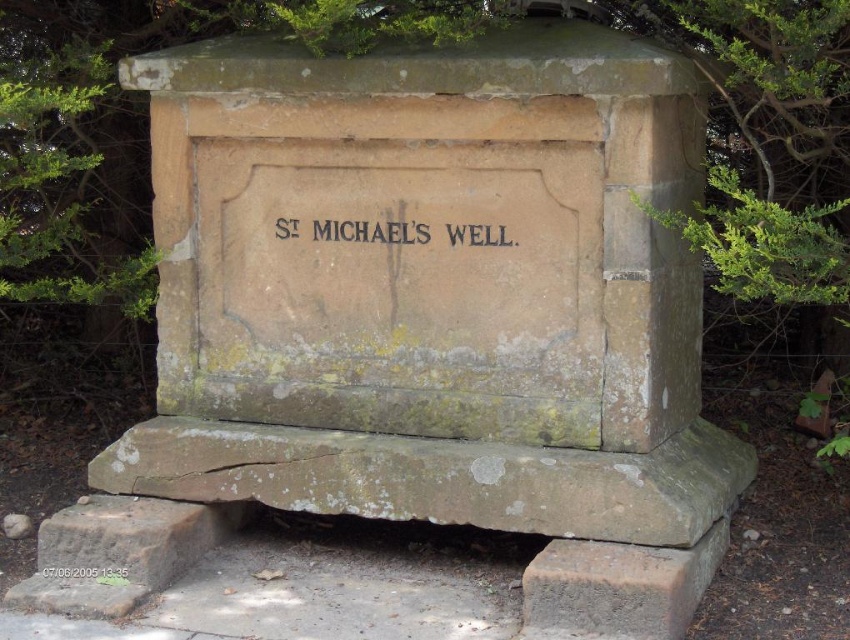
You are a hiker who has reached the brown stone monument at center and the black stone engraving at center. Which object is closer to you as you stand in front of them?

The brown stone monument at center is closer to you since it is in front of the black stone engraving at center.

You are a historian examining the brown stone monument at center and the black stone engraving at center. Which object is taller?

The brown stone monument at center is taller than the black stone engraving at center.

You are a historian examining the St. Michael Well site. You notice two stone items at the center of the monument. Which one is bigger between the black stone engraving at center and the dark brown stone plaque at center?

The black stone engraving at center has a larger size compared to the dark brown stone plaque at center.